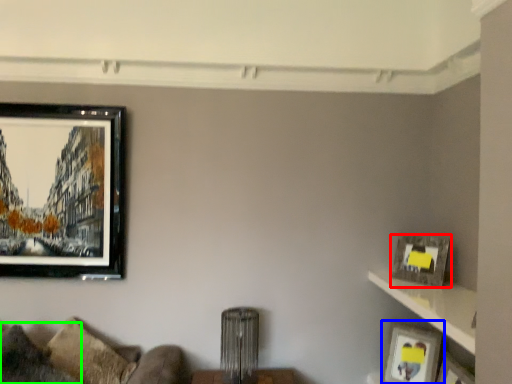
Question: Estimate the real-world distances between objects in this image. Which object is farther from picture frame (highlighted by a red box), picture frame (highlighted by a blue box) or pillow (highlighted by a green box)?

Choices:
 (A) picture frame
 (B) pillow

Answer: (B)